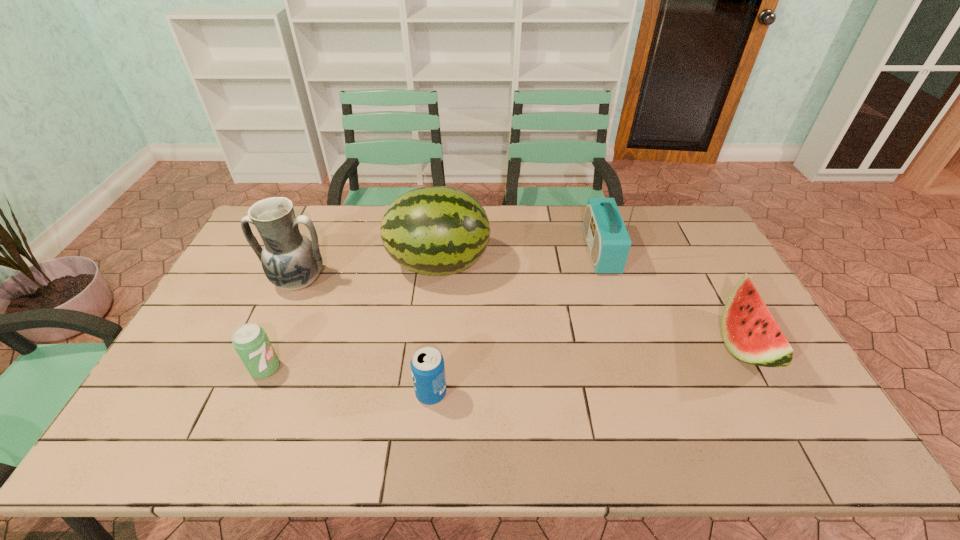
You are a GUI agent. You are given a task and a screenshot of the screen. Output one action in this format:
    pyautogui.click(x=<x>, y=<y>)
    Task: Click on the tallest object
    
    Given the screenshot: What is the action you would take?
    pyautogui.click(x=608, y=241)

Where is `radio receiver`? This screenshot has width=960, height=540. radio receiver is located at coordinates (608, 241).

In order to click on pitcher in this screenshot , I will do `click(291, 261)`.

This screenshot has height=540, width=960. What are the coordinates of `the farther watermelon` in the screenshot? It's located at (436, 230).

Locate an element on the screen. the left watermelon is located at coordinates (436, 230).

At what (x,y) coordinates should I click in order to perform the action: click on the right watermelon. Please return your answer as a coordinate pair (x, y). Image resolution: width=960 pixels, height=540 pixels. Looking at the image, I should click on (749, 331).

Where is `the shorter watermelon`? The image size is (960, 540). the shorter watermelon is located at coordinates (749, 331).

The width and height of the screenshot is (960, 540). What are the coordinates of `the right soda` in the screenshot? It's located at (427, 364).

This screenshot has width=960, height=540. In order to click on the left soda in this screenshot , I will do `click(250, 341)`.

The image size is (960, 540). Find the location of `free region located on the front panel of the tallest object`. free region located on the front panel of the tallest object is located at coordinates (495, 251).